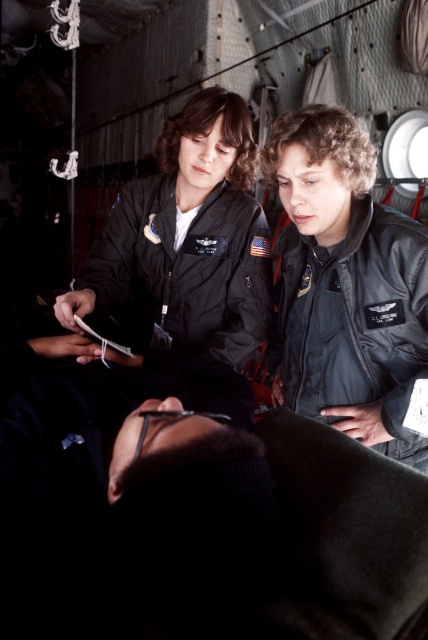
Where is `black leather jacket at center`? black leather jacket at center is located at coordinates (345, 285).

What do you see at coordinates (345, 285) in the screenshot? The height and width of the screenshot is (640, 428). I see `black leather jacket at center` at bounding box center [345, 285].

Locate an element on the screen. The image size is (428, 640). black leather jacket at center is located at coordinates (345, 285).